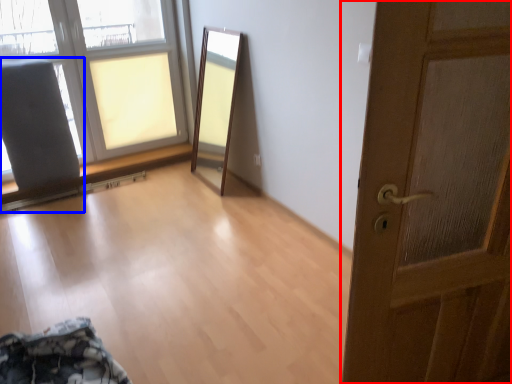
Question: Which point is closer to the camera, door (highlighted by a red box) or armchair (highlighted by a blue box)?

Choices:
 (A) door
 (B) armchair

Answer: (A)